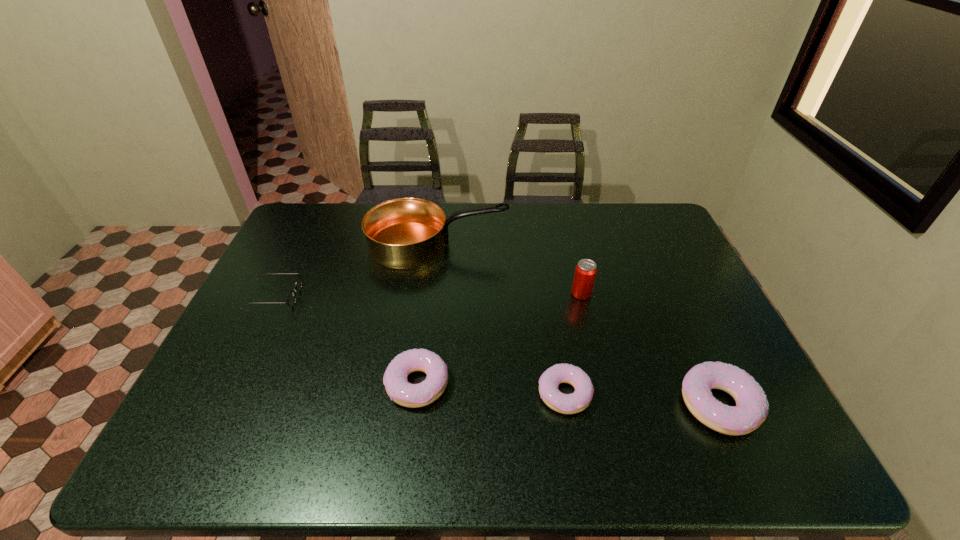
Where is `free space that satisfies the following two spatial constraints: 1. on the handle side of the frying pan; 2. on the left side of the can`? This screenshot has width=960, height=540. free space that satisfies the following two spatial constraints: 1. on the handle side of the frying pan; 2. on the left side of the can is located at coordinates (432, 294).

Image resolution: width=960 pixels, height=540 pixels. In order to click on vacant position in the image that satisfies the following two spatial constraints: 1. on the handle side of the fifth object from left to right; 2. on the right side of the farthest object in this screenshot , I will do `click(432, 294)`.

You are a GUI agent. You are given a task and a screenshot of the screen. Output one action in this format:
    pyautogui.click(x=<x>, y=<y>)
    Task: Click on the vacant point that satisfies the following two spatial constraints: 1. on the back side of the leftmost doughnut; 2. through the lenses of the spectacles
    The width and height of the screenshot is (960, 540).
    Given the screenshot: What is the action you would take?
    pyautogui.click(x=428, y=297)

This screenshot has height=540, width=960. Find the location of `free region that satisfies the following two spatial constraints: 1. on the back side of the fourth tallest object; 2. through the lenses of the spectacles`. free region that satisfies the following two spatial constraints: 1. on the back side of the fourth tallest object; 2. through the lenses of the spectacles is located at coordinates (428, 297).

I want to click on free region that satisfies the following two spatial constraints: 1. on the handle side of the frying pan; 2. on the back side of the can, so click(432, 294).

Identify the location of free spot that satisfies the following two spatial constraints: 1. through the lenses of the leftmost object; 2. on the left side of the rightmost doughnut. The width and height of the screenshot is (960, 540). (222, 404).

Where is `vacant space that satisfies the following two spatial constraints: 1. on the handle side of the tallest object; 2. on the back side of the can`? The image size is (960, 540). vacant space that satisfies the following two spatial constraints: 1. on the handle side of the tallest object; 2. on the back side of the can is located at coordinates (432, 294).

The image size is (960, 540). I want to click on free space that satisfies the following two spatial constraints: 1. through the lenses of the rightmost doughnut; 2. on the right side of the leftmost object, so click(222, 404).

Where is `vacant region that satisfies the following two spatial constraints: 1. on the handle side of the second object from right to left; 2. on the left side of the frying pan`? The image size is (960, 540). vacant region that satisfies the following two spatial constraints: 1. on the handle side of the second object from right to left; 2. on the left side of the frying pan is located at coordinates (432, 294).